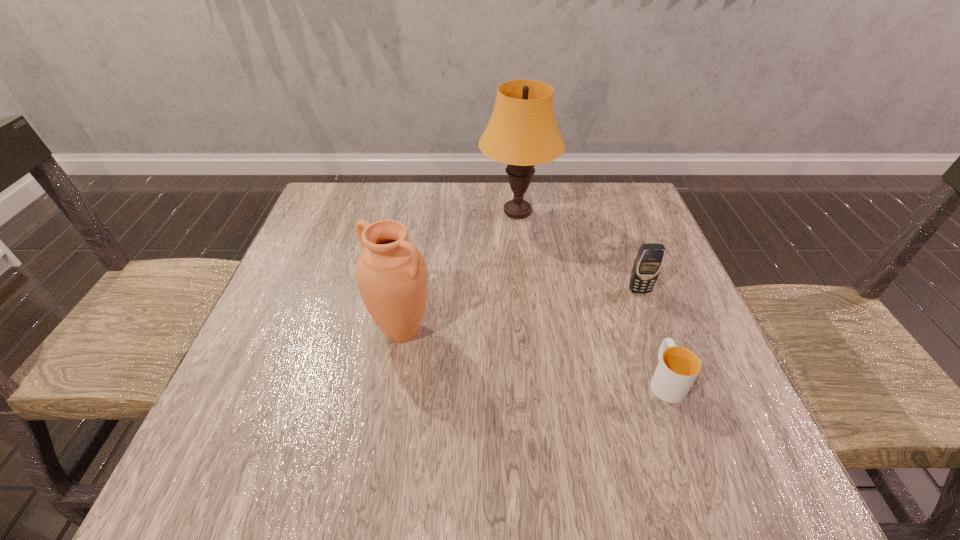
Locate an element on the screen. The width and height of the screenshot is (960, 540). free space between the tallest object and the cup is located at coordinates (591, 296).

Where is `free space between the cellular telephone and the urn`? The height and width of the screenshot is (540, 960). free space between the cellular telephone and the urn is located at coordinates (520, 311).

Locate an element on the screen. free space between the nearest object and the third shortest object is located at coordinates (534, 355).

Find the location of a particular element. The width and height of the screenshot is (960, 540). empty space that is in between the third shortest object and the third tallest object is located at coordinates (520, 311).

This screenshot has height=540, width=960. I want to click on empty space that is in between the second shortest object and the cup, so click(x=652, y=335).

Choose which object is the third nearest neighbor to the third nearest object. Please provide its 2D coordinates. Your answer should be formatted as a tuple, i.e. [(x, y)], where the tuple contains the x and y coordinates of a point satisfying the conditions above.

[(391, 273)]

Identify which object is located as the nearest to the lampshade. Please provide its 2D coordinates. Your answer should be formatted as a tuple, i.e. [(x, y)], where the tuple contains the x and y coordinates of a point satisfying the conditions above.

[(649, 260)]

Locate an element on the screen. vacant point that satisfies the following two spatial constraints: 1. on the back side of the third farthest object; 2. on the left side of the tallest object is located at coordinates (422, 212).